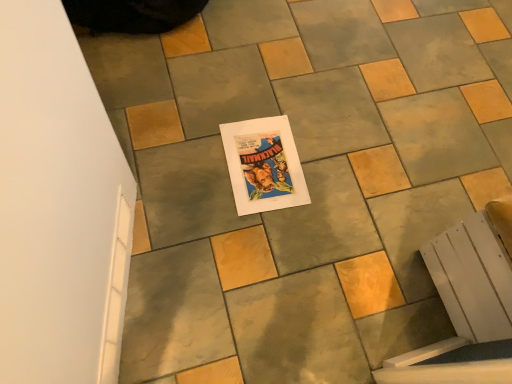
Describe the element at coordinates (264, 165) in the screenshot. This screenshot has height=384, width=512. I see `vibrant paper comic book at center` at that location.

In order to face vibrant paper comic book at center, should I rotate leftwards or rightwards?

Turn right by 1.060 degrees to look at vibrant paper comic book at center.

Locate an element on the screen. The height and width of the screenshot is (384, 512). vibrant paper comic book at center is located at coordinates (264, 165).

Identify the location of vibrant paper comic book at center. The image size is (512, 384). (264, 165).